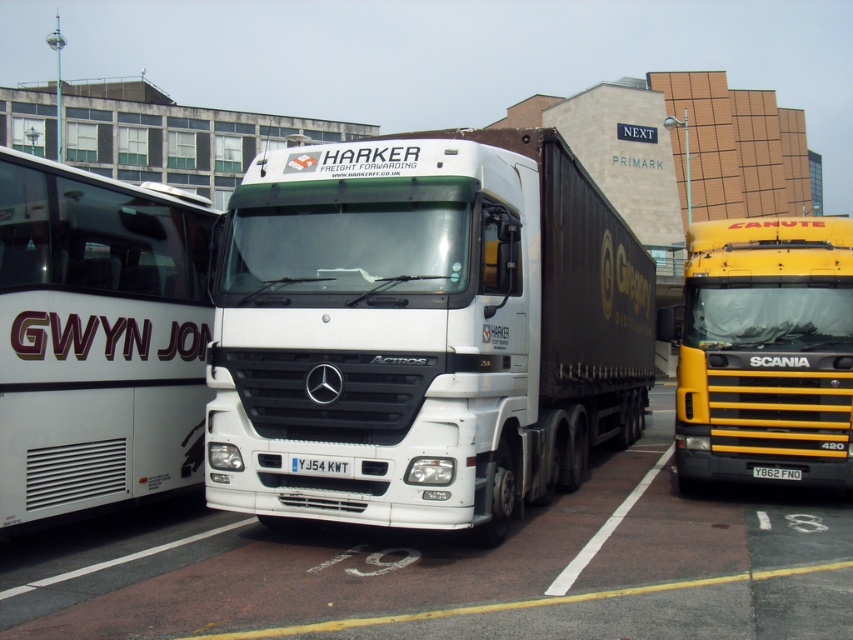
Does white matte truck at center appear on the left side of black metal license plate at center?

Indeed, white matte truck at center is positioned on the left side of black metal license plate at center.

Consider the image. Between white matte truck at center and black metal license plate at center, which one is positioned lower?

white matte truck at center is below.

Identify the location of white matte truck at center. (456, 568).

Does white plastic license plate at center have a lesser height compared to black metal license plate at center?

No.

Who is higher up, white plastic license plate at center or black metal license plate at center?

white plastic license plate at center is higher up.

Locate an element on the screen. white plastic license plate at center is located at coordinates (320, 465).

At what (x,y) coordinates should I click in order to perform the action: click on white plastic license plate at center. Please return your answer as a coordinate pair (x, y). Looking at the image, I should click on (320, 465).

Can you confirm if yellow metallic truck at right is wider than white plastic license plate at center?

No, yellow metallic truck at right is not wider than white plastic license plate at center.

The width and height of the screenshot is (853, 640). I want to click on yellow metallic truck at right, so click(766, 349).